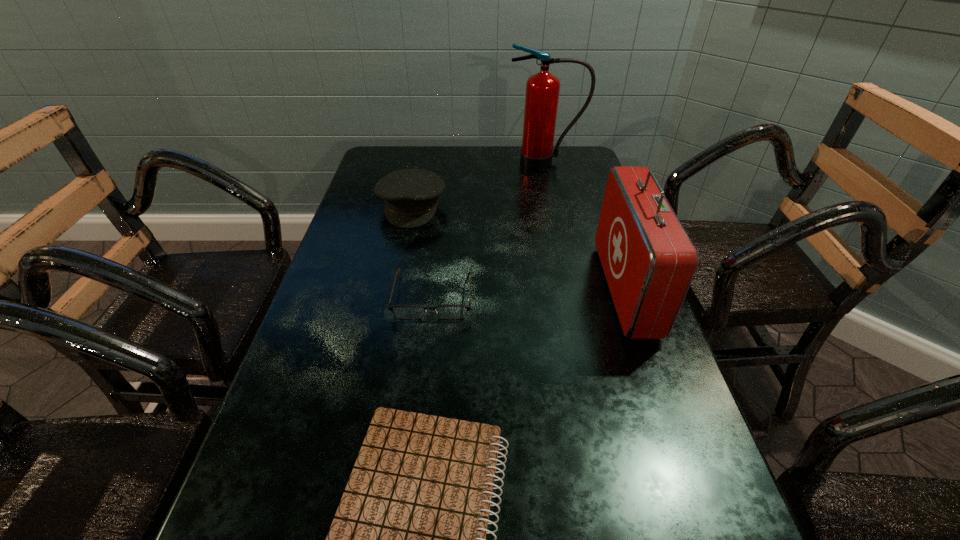
In order to click on vacant area situated on the front-facing side of the fourth nearest object in this screenshot , I will do `click(399, 269)`.

At what (x,y) coordinates should I click in order to perform the action: click on vacant space located on the front-facing side of the spectacles. Please return your answer as a coordinate pair (x, y). Looking at the image, I should click on (425, 365).

At what (x,y) coordinates should I click in order to perform the action: click on object that is at the far edge. Please return your answer as a coordinate pair (x, y). This screenshot has width=960, height=540. Looking at the image, I should click on coord(542,89).

The image size is (960, 540). Identify the location of object that is at the left edge. (411, 196).

Find the location of a particular element. This screenshot has width=960, height=540. fire extinguisher that is at the right edge is located at coordinates (542, 89).

Image resolution: width=960 pixels, height=540 pixels. Find the location of `the first-aid kit at the right edge`. the first-aid kit at the right edge is located at coordinates (649, 261).

Identify the location of object that is at the far right corner. This screenshot has width=960, height=540. (542, 89).

This screenshot has width=960, height=540. In the image, there is a desktop. In order to click on vacant space at the far edge in this screenshot , I will do `click(511, 153)`.

In the image, there is a desktop. Where is `vacant space at the left edge`? vacant space at the left edge is located at coordinates (240, 524).

The image size is (960, 540). I want to click on vacant space at the right edge of the desktop, so click(x=573, y=215).